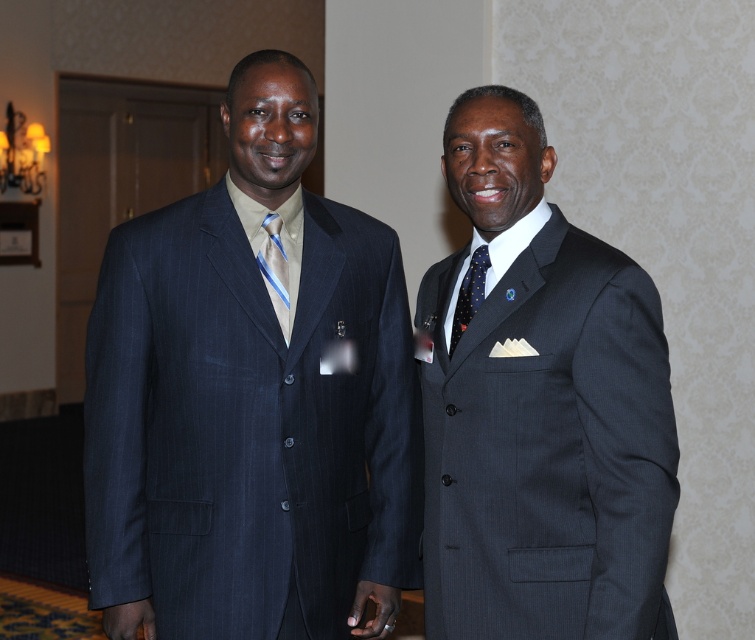
You are organizing a photo shoot for a fashion magazine and need to ensure that all accessories are visible in the final shot. Given the scene described, will the blue striped tie at center be fully visible when photographing the matte pinstripe suit at left from a standard camera angle?

The matte pinstripe suit at left is taller than the blue striped tie at center, so the tie may be partially obscured depending on the angle. Ensure the camera captures the full length of the suit and tie to avoid cropping the tie.

You are a photographer at a formal event. You want to take a group photo of the two men in the image. The minimum distance required between subjects for your camera to focus properly is 50 centimeters. Can the matte pinstripe suit at left and the dark blue dotted tie at right be captured in focus in the same photo?

The matte pinstripe suit at left and the dark blue dotted tie at right are 54.18 centimeters apart from each other, which exceeds the 50 centimeter minimum distance required for proper focus. Therefore, they can be captured in focus in the same photo.

You are organizing a photo shoot and need to ensure there is enough space between two models wearing the matte pinstripe suit at left and dark gray pinstripe suit at right. The minimum required distance between them is 15 inches. Based on the scene description, will the current spacing meet the requirement?

The matte pinstripe suit at left is 16.26 inches from the dark gray pinstripe suit at right, which exceeds the minimum required distance of 15 inches. Therefore, the current spacing meets the requirement.